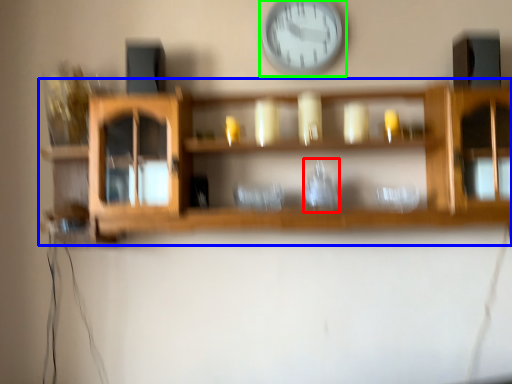
Question: Which object is positioned farthest from glass vase (highlighted by a red box)? Select from shelf (highlighted by a blue box) and wall clock (highlighted by a green box).

Choices:
 (A) shelf
 (B) wall clock

Answer: (B)